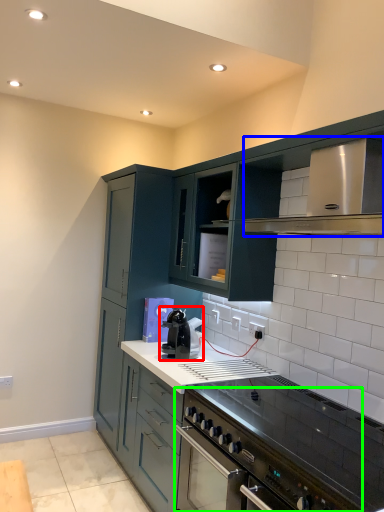
Question: Which object is the farthest from home appliance (highlighted by a red box)? Choose among these: vent (highlighted by a blue box) or kitchen appliance (highlighted by a green box).

Choices:
 (A) vent
 (B) kitchen appliance

Answer: (A)